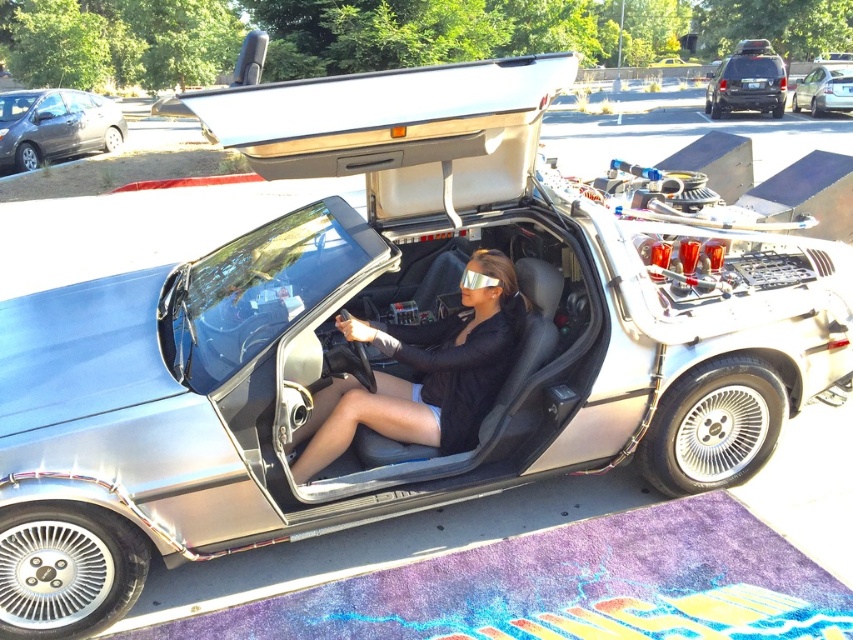
You are a photographer trying to capture both the silver metallic sedan at upper right and the silver reflective goggles at center in a single frame. Given their sizes, which object should you focus on first to ensure both fit in the photo?

The silver metallic sedan at upper right is larger in size than the silver reflective goggles at center, so you should focus on positioning the silver metallic sedan at upper right first to ensure it fits properly in the frame, allowing space for the smaller goggles.

You are a photographer positioned to the front of the DeLorean car. You want to take a photo focusing on the matte black jacket at center and the silver reflective goggles at center. Which object should you adjust your camera to focus on first if you want to capture both in one shot, considering their positions?

The matte black jacket at center is to the left of silver reflective goggles at center, so you should focus on the matte black jacket at center first as it is closer to the left side of the frame to ensure both are in the shot.

Based on the photo, you are a photographer positioned at the back of the scene. You want to take a photo of the silver metallic sedan at upper right without the matte black jacket at center blocking the view. Is this possible?

The matte black jacket at center is in front of the silver metallic sedan at upper right, so it will block the view. Move to a different angle where the matte black jacket at center is not obstructing the silver metallic sedan at upper right.